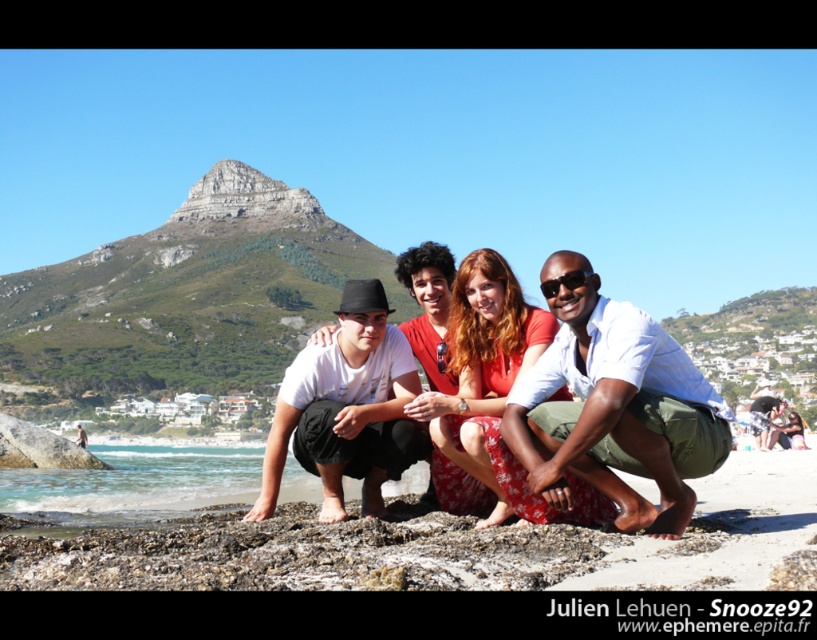
Which is more to the right, smooth sand at center or white cotton shirt at center?

white cotton shirt at center

Is smooth sand at center positioned before white cotton shirt at center?

Yes, it is in front of white cotton shirt at center.

Is point (567, 541) closer to camera compared to point (565, 460)?

Yes, point (567, 541) is in front of point (565, 460).

This screenshot has height=640, width=817. I want to click on smooth sand at center, so tap(382, 532).

Does white cotton shirt at center have a greater width compared to matte white t-shirt at center?

Indeed, white cotton shirt at center has a greater width compared to matte white t-shirt at center.

Based on the photo, who is lower down, white cotton shirt at center or matte white t-shirt at center?

matte white t-shirt at center

Does point (597, 424) lie in front of point (436, 321)?

Yes, point (597, 424) is in front of point (436, 321).

Locate an element on the screen. This screenshot has width=817, height=640. white cotton shirt at center is located at coordinates (615, 412).

Does point (307, 468) lie behind point (583, 282)?

That is True.

Between white matte shirt at center and black plastic sunglasses at center, which one appears on the left side from the viewer's perspective?

From the viewer's perspective, white matte shirt at center appears more on the left side.

Consider the image. Who is more forward, (327, 509) or (542, 289)?

Point (542, 289)

Locate an element on the screen. The image size is (817, 640). white matte shirt at center is located at coordinates (347, 408).